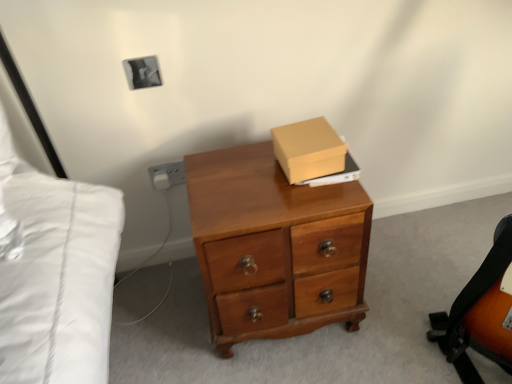
Where is `free space behind orange leather messenger bag at lower right`? The width and height of the screenshot is (512, 384). free space behind orange leather messenger bag at lower right is located at coordinates (419, 284).